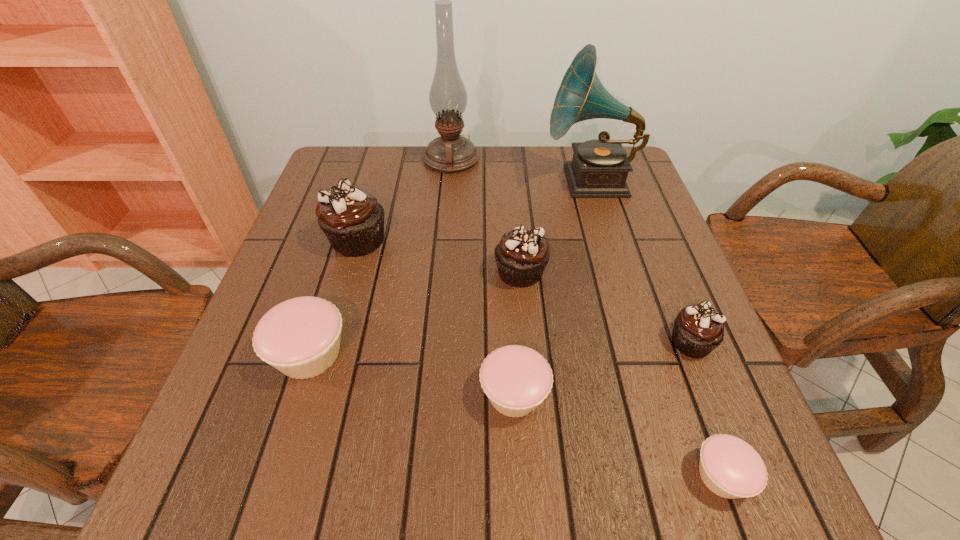
Image resolution: width=960 pixels, height=540 pixels. In the image, there is a desktop. Find the location of `vacant space at the far edge`. vacant space at the far edge is located at coordinates coord(572,160).

Locate an element on the screen. Image resolution: width=960 pixels, height=540 pixels. free space at the near edge is located at coordinates (378, 483).

This screenshot has height=540, width=960. In order to click on free location at the left edge of the desktop in this screenshot , I will do `click(254, 380)`.

The image size is (960, 540). In the image, there is a desktop. Find the location of `vacant space at the right edge`. vacant space at the right edge is located at coordinates (685, 273).

At what (x,y) coordinates should I click in order to perform the action: click on vacant space at the far left corner. Please return your answer as a coordinate pair (x, y). Looking at the image, I should click on (328, 160).

Where is `vacant area at the near left corner of the desktop`? vacant area at the near left corner of the desktop is located at coordinates (256, 507).

Where is `vacant region at the near right corner of the desktop`? The height and width of the screenshot is (540, 960). vacant region at the near right corner of the desktop is located at coordinates (673, 467).

Locate an element on the screen. The width and height of the screenshot is (960, 540). empty location between the phonograph_record and the nearest brown cupcake is located at coordinates (640, 262).

Locate an element on the screen. The width and height of the screenshot is (960, 540). free space that is in between the biggest brown cupcake and the sixth object from right to left is located at coordinates (404, 200).

Locate an element on the screen. free space between the bronze oil lamp and the nearest cupcake is located at coordinates (587, 318).